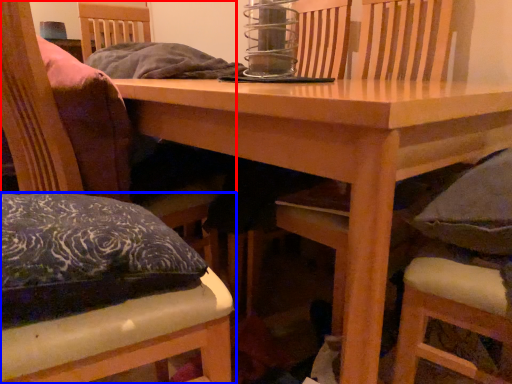
Question: Which object appears farthest to the camera in this image, chair (highlighted by a red box) or chair (highlighted by a blue box)?

Choices:
 (A) chair
 (B) chair

Answer: (B)